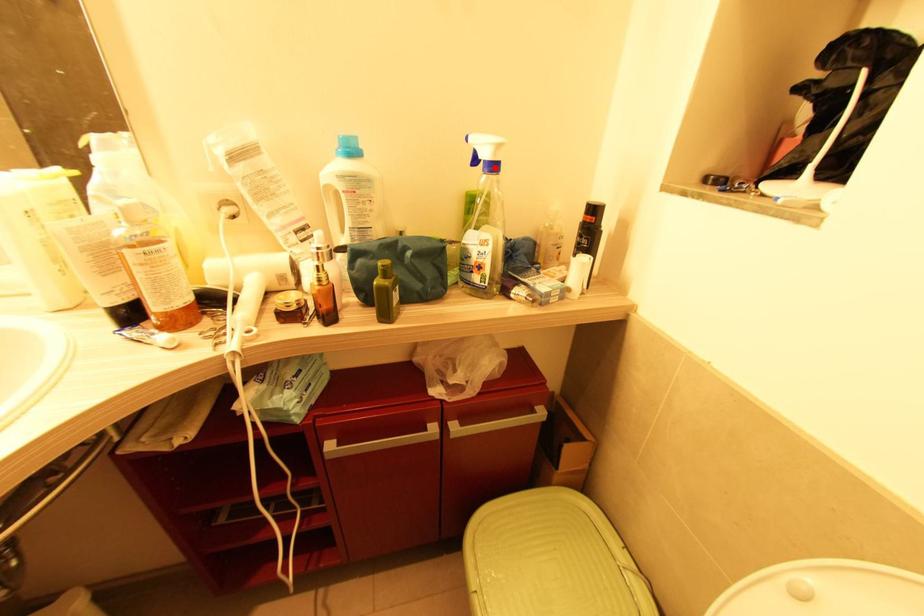
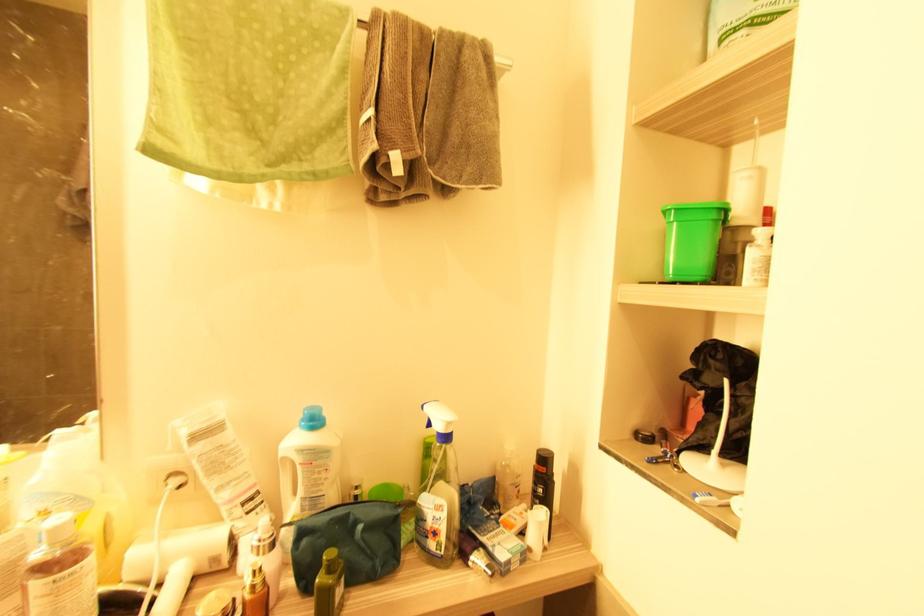
The point at the highlighted location is marked in the first image. Where is the corresponding point in the second image?

(447, 438)